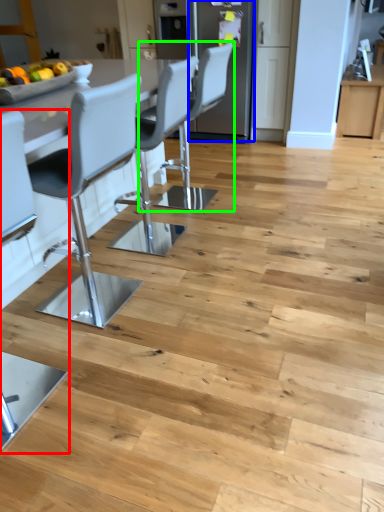
Question: Which object is the farthest from chair (highlighted by a red box)? Choose among these: appliance (highlighted by a blue box) or chair (highlighted by a green box).

Choices:
 (A) appliance
 (B) chair

Answer: (A)